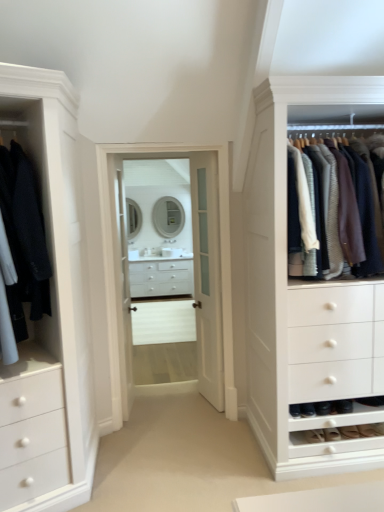
Locate an element on the screen. vacant point above clear glass door at center, which is the 1th glass door in right-to-left order (from a real-world perspective) is located at coordinates (167, 143).